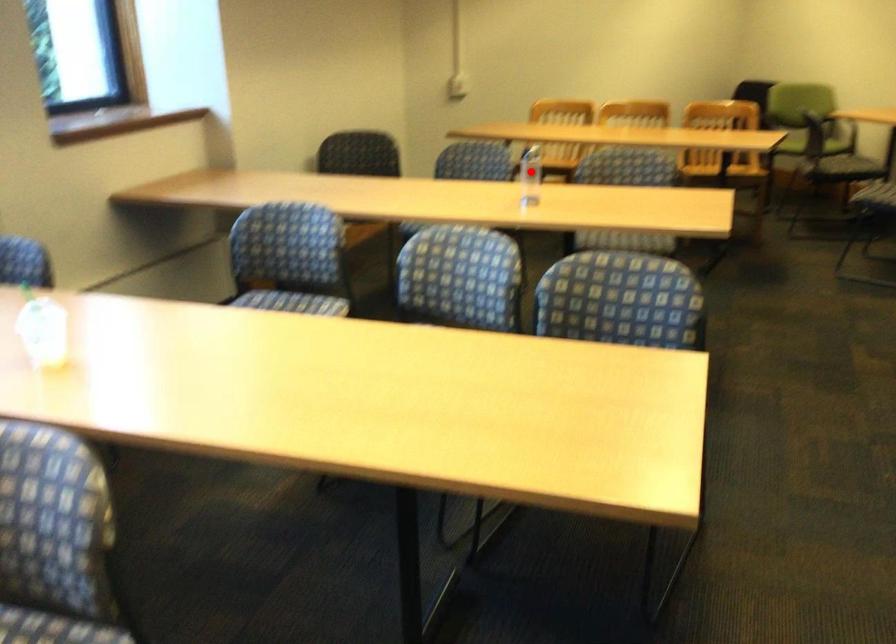
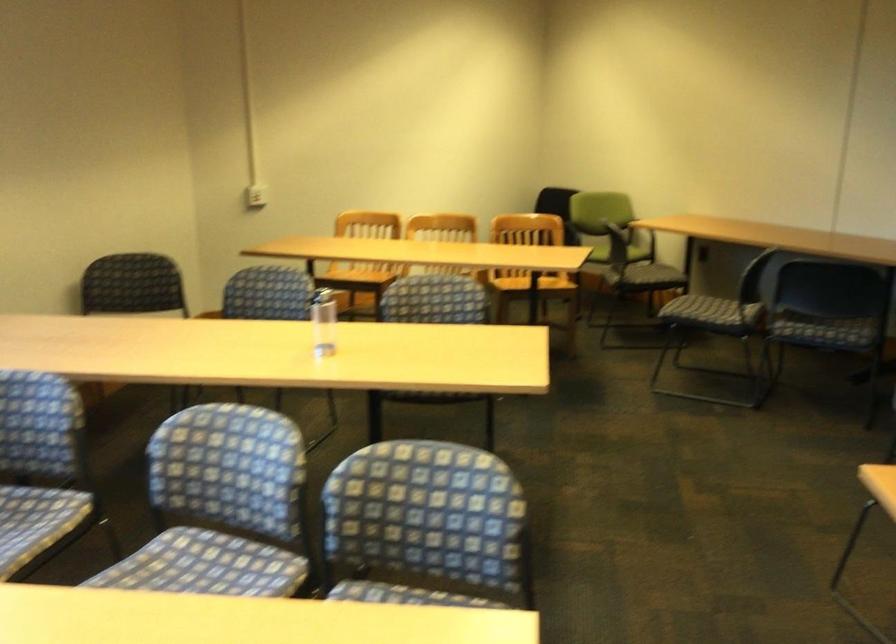
Question: I am providing you with two images of the same scene from different viewpoints. Given a red point in image1, look at the same physical point in image2. Is it:

Choices:
 (A) Closer to the viewpoint
 (B) Farther from the viewpoint

Answer: (A)